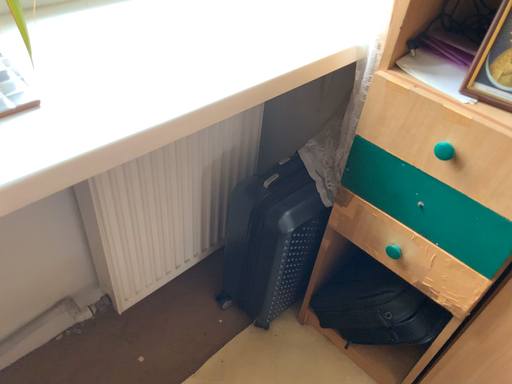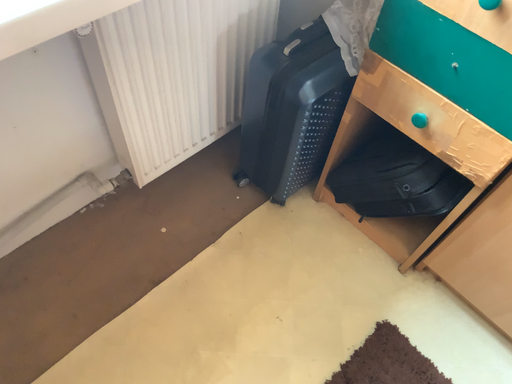
Question: How did the camera likely rotate when shooting the video?

Choices:
 (A) rotated downward
 (B) rotated upward

Answer: (A)